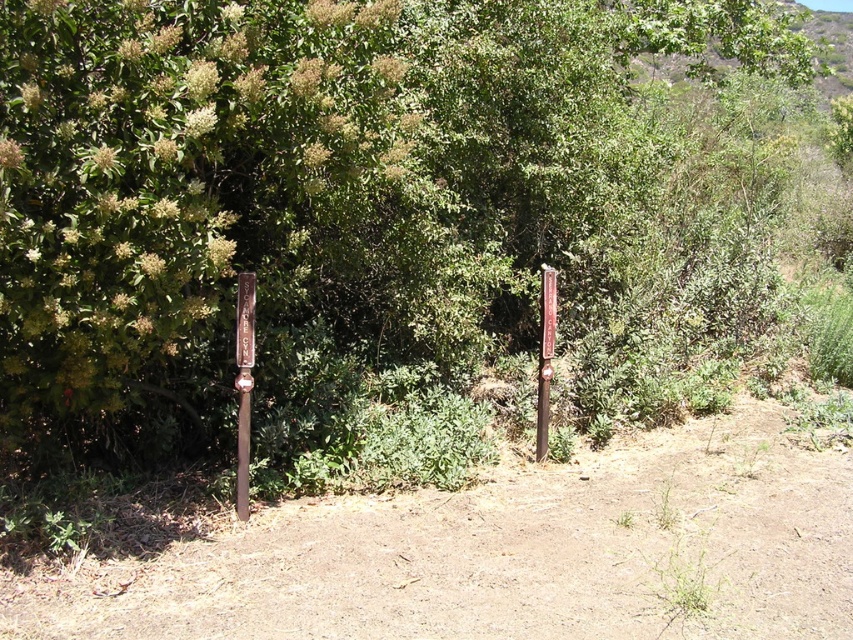
You are standing at the trailhead and want to take a photo of the green leafy tree at center. If your camera has a maximum focus range of 5 meters, will you need to move closer to the tree to capture it clearly?

The green leafy tree at center is 5.25 meters away from viewer. Since the camera can only focus up to 5 meters, you need to move closer to the tree to ensure it is in focus.

You are standing at the trailhead and see the green leafy tree at center. If you want to walk directly towards it, which direction should you head from your current position?

The green leafy tree at center is located at point (320, 186), so you should head towards the center of the image to reach it.